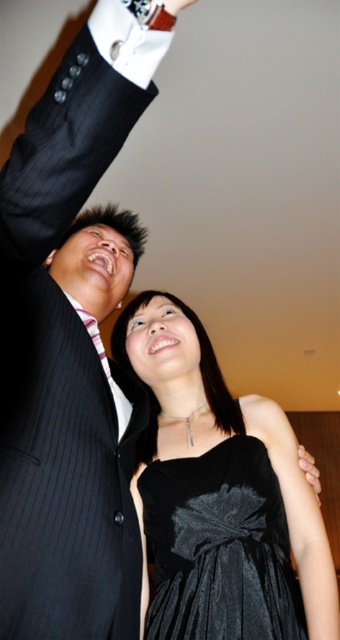
Question: Does dark pinstripe suit at upper left have a smaller size compared to matte black hand at upper center?

Choices:
 (A) no
 (B) yes

Answer: (A)

Question: Which point is farther to the camera?

Choices:
 (A) (179, 6)
 (B) (314, 465)

Answer: (B)

Question: Is dark pinstripe suit at upper left positioned behind matte black dress at lower center?

Choices:
 (A) no
 (B) yes

Answer: (A)

Question: Is the position of black velvet dress at center less distant than that of striped fabric tie at upper left?

Choices:
 (A) no
 (B) yes

Answer: (B)

Question: Among these points, which one is nearest to the camera?

Choices:
 (A) (9, 493)
 (B) (236, 534)

Answer: (A)

Question: Which point is farther from the camera taking this photo?

Choices:
 (A) (178, 8)
 (B) (171, 467)

Answer: (B)